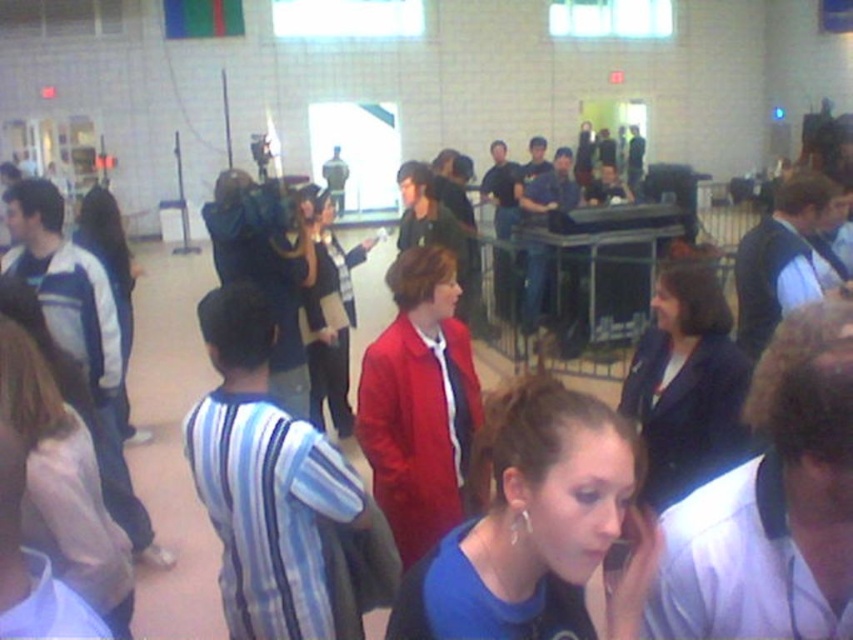
Question: Does blue matte shirt at lower right have a smaller size compared to white fleece jacket at left?

Choices:
 (A) yes
 (B) no

Answer: (A)

Question: Is blue matte shirt at lower right to the right of light pink fabric blouse at lower left from the viewer's perspective?

Choices:
 (A) yes
 (B) no

Answer: (A)

Question: Estimate the real-world distances between objects in this image. Which object is farther from the white fleece jacket at left?

Choices:
 (A) light pink fabric blouse at lower left
 (B) matte red coat at center
 (C) blue matte shirt at lower right

Answer: (C)

Question: Estimate the real-world distances between objects in this image. Which object is farther from the blue matte shirt at lower right?

Choices:
 (A) matte red coat at center
 (B) light pink fabric blouse at lower left

Answer: (A)

Question: Which object is closer to the camera taking this photo?

Choices:
 (A) matte red coat at center
 (B) blue matte shirt at lower right
 (C) white fleece jacket at left
 (D) matte black blazer at center

Answer: (B)

Question: Does matte black blazer at center lie behind light pink fabric blouse at lower left?

Choices:
 (A) yes
 (B) no

Answer: (A)